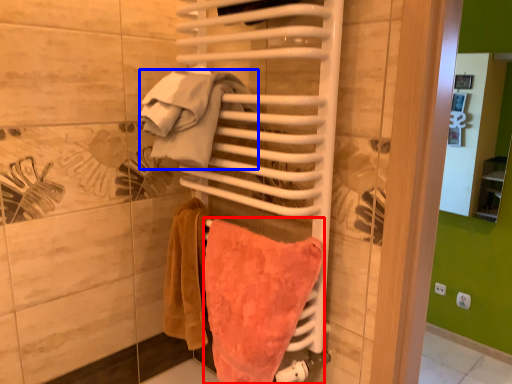
Question: Which object is closer to the camera taking this photo, towel (highlighted by a red box) or beach towel (highlighted by a blue box)?

Choices:
 (A) towel
 (B) beach towel

Answer: (A)